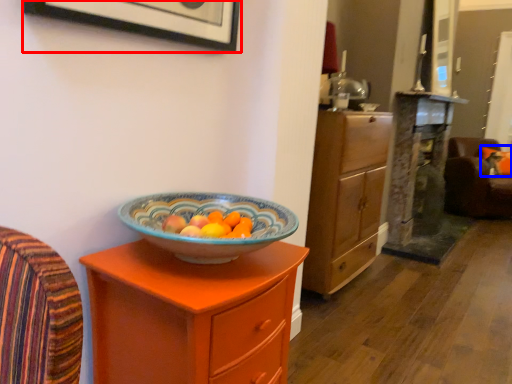
Question: Which point is closer to the camera, picture frame (highlighted by a red box) or pillow (highlighted by a blue box)?

Choices:
 (A) picture frame
 (B) pillow

Answer: (A)